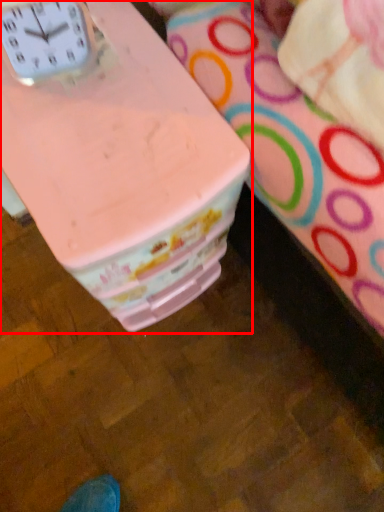
Question: From the image's perspective, where is table (annotated by the red box) located relative to clock?

Choices:
 (A) above
 (B) below

Answer: (B)